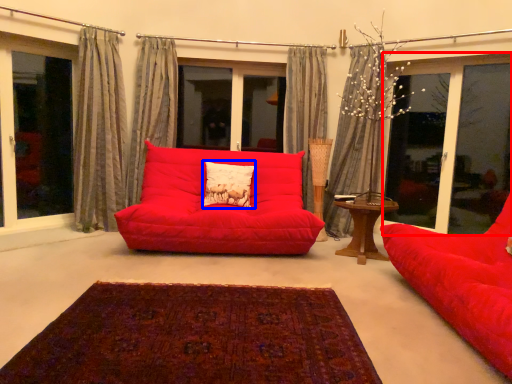
Question: Which of the following is the closest to the observer, window (highlighted by a red box) or pillow (highlighted by a blue box)?

Choices:
 (A) window
 (B) pillow

Answer: (A)